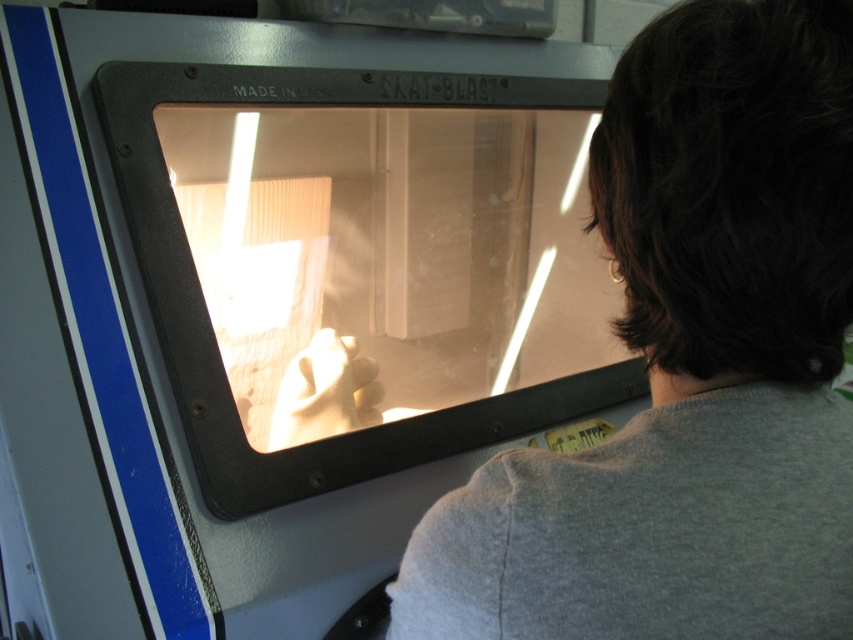
Question: Which point is closer to the camera taking this photo?

Choices:
 (A) (294, 204)
 (B) (578, 589)

Answer: (B)

Question: Which point is farther to the camera?

Choices:
 (A) (590, 454)
 (B) (299, 308)

Answer: (B)

Question: Can you confirm if gray cotton shirt at center is bigger than transparent glass screen at center?

Choices:
 (A) yes
 (B) no

Answer: (B)

Question: Is gray cotton shirt at center above transparent glass screen at center?

Choices:
 (A) yes
 (B) no

Answer: (B)

Question: Does gray cotton shirt at center have a smaller size compared to transparent glass screen at center?

Choices:
 (A) no
 (B) yes

Answer: (B)